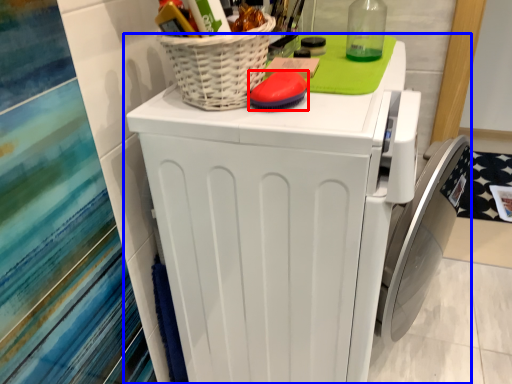
Question: Which point is closer to the camera, soap (highlighted by a red box) or home appliance (highlighted by a blue box)?

Choices:
 (A) soap
 (B) home appliance

Answer: (B)